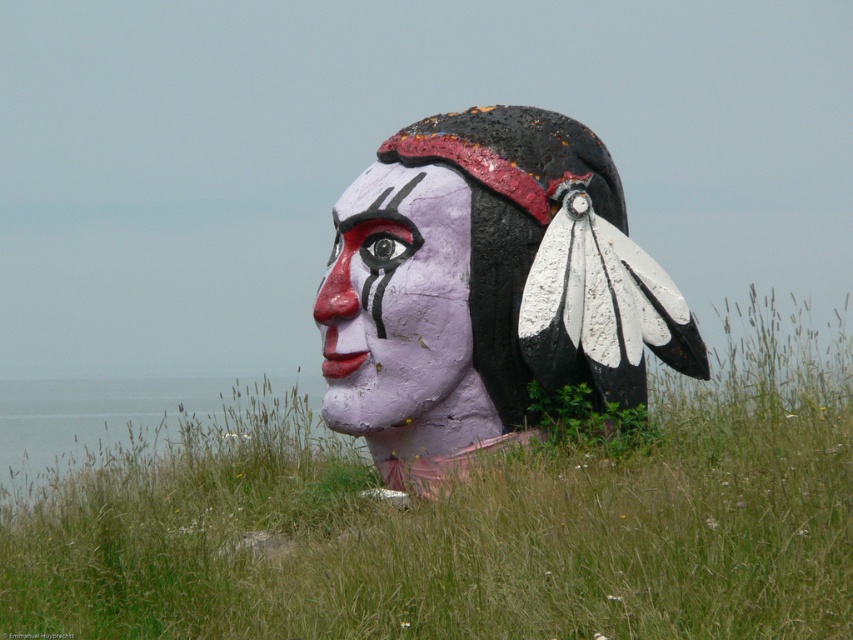
Question: Where is matte purple head at center located in relation to matte purple mask at center in the image?

Choices:
 (A) above
 (B) below

Answer: (A)

Question: Is matte pink statue at center behind matte purple head at center?

Choices:
 (A) no
 (B) yes

Answer: (A)

Question: Observing the image, what is the correct spatial positioning of matte purple head at center in reference to matte purple mask at center?

Choices:
 (A) left
 (B) right

Answer: (B)

Question: Which of the following is the farthest from the observer?

Choices:
 (A) (556, 252)
 (B) (721, 630)

Answer: (A)

Question: Which is nearer to the matte pink statue at center?

Choices:
 (A) matte purple mask at center
 (B) matte purple head at center

Answer: (B)

Question: Estimate the real-world distances between objects in this image. Which object is farther from the matte pink statue at center?

Choices:
 (A) matte purple head at center
 (B) matte purple mask at center

Answer: (B)